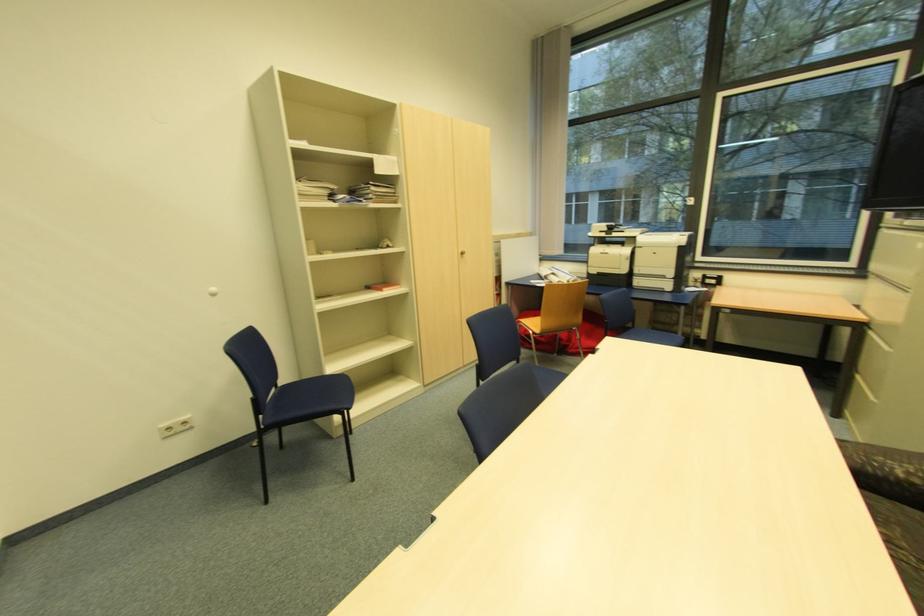
The width and height of the screenshot is (924, 616). I want to click on cabinet door handle, so click(x=462, y=253).